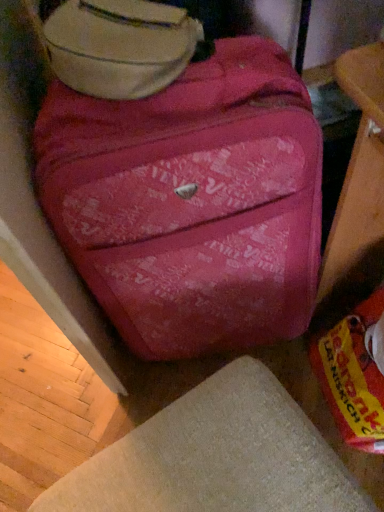
Question: Looking at their shapes, would you say matte pink suitcase at upper center is wider or thinner than matte pink suitcase at center?

Choices:
 (A) thin
 (B) wide

Answer: (A)

Question: From the image's perspective, relative to matte pink suitcase at center, is matte pink suitcase at upper center above or below?

Choices:
 (A) above
 (B) below

Answer: (A)

Question: Estimate the real-world distances between objects in this image. Which object is closer to the matte pink suitcase at upper center?

Choices:
 (A) beige fabric ottoman at lower center
 (B) matte pink suitcase at center

Answer: (B)

Question: Estimate the real-world distances between objects in this image. Which object is farther from the matte pink suitcase at upper center?

Choices:
 (A) matte pink suitcase at center
 (B) beige fabric ottoman at lower center

Answer: (B)